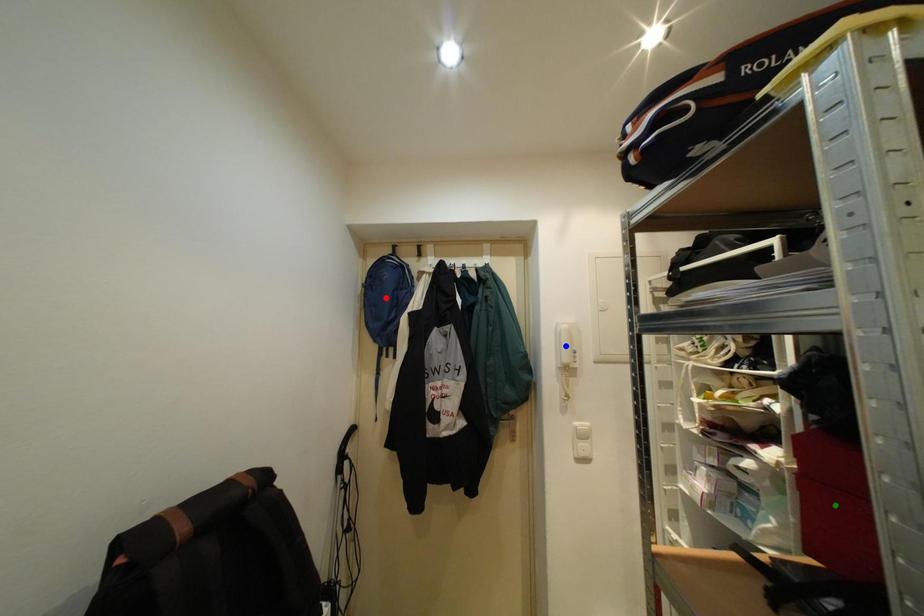
Order these from nearest to farthest:
green point | blue point | red point

1. red point
2. blue point
3. green point